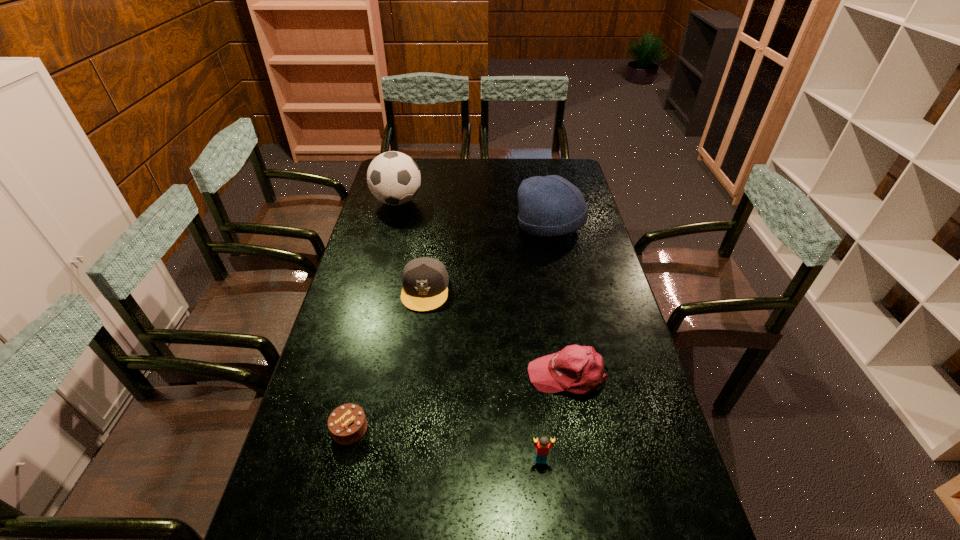
The height and width of the screenshot is (540, 960). Find the location of `soccer ball`. soccer ball is located at coordinates (393, 178).

This screenshot has height=540, width=960. Find the location of `skullcap`. skullcap is located at coordinates (549, 206).

Find the location of a particular element. the fourth farthest object is located at coordinates (577, 369).

I want to click on the third farthest object, so click(425, 280).

Find the location of a particular element. the nearest object is located at coordinates (542, 447).

The width and height of the screenshot is (960, 540). In order to click on the fifth farthest object in this screenshot , I will do `click(347, 424)`.

Find the location of `chocolate cake`. chocolate cake is located at coordinates (347, 424).

You are a GUI agent. You are given a task and a screenshot of the screen. Output one action in this format:
    pyautogui.click(x=<x>, y=<y>)
    Task: Click on the free spot located 0.050m on the right of the soccer ball
    This screenshot has height=540, width=960.
    Given the screenshot: What is the action you would take?
    pyautogui.click(x=435, y=201)

What are the coordinates of `vacant space positioned on the front of the skullcap` in the screenshot? It's located at (564, 289).

Locate an element on the screen. The height and width of the screenshot is (540, 960). free spot located 0.390m at the front of the fourth farthest object with the brim is located at coordinates (388, 375).